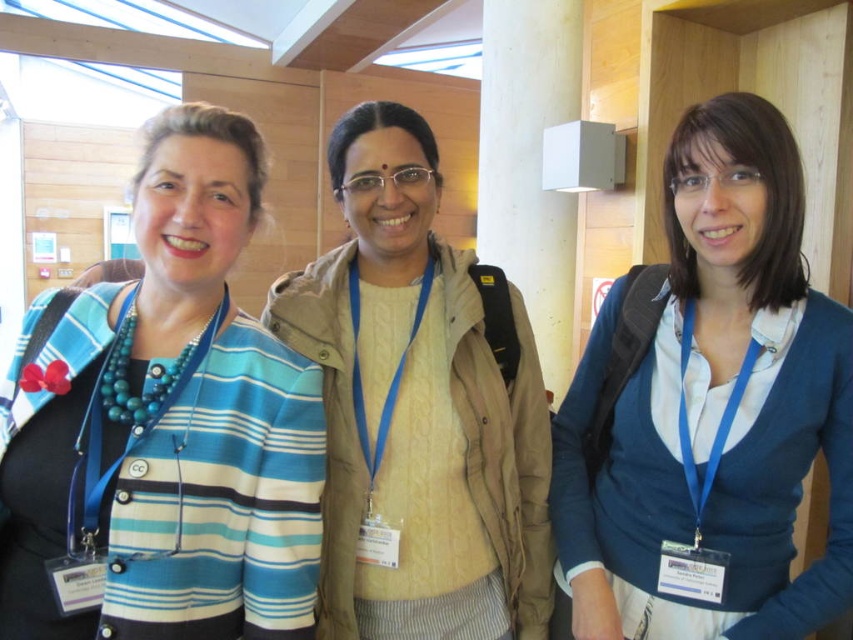
You are standing in the conference room and want to take a photo of the blue striped cardigan at left. Where should you position yourself to capture it in the frame?

To capture the blue striped cardigan at left in the frame, position yourself facing the cardigan and ensure your camera is aimed at the coordinates approximately at point 0.669 on the horizontal axis and 0.193 on the vertical axis, as specified by the object description.

You are a photographer trying to capture a clear shot of both the blue matte sweater at center and the beige woolen sweater at center. Which sweater should you focus on first to ensure both are in focus?

You should focus on the blue matte sweater at center first since it is closer to the viewer, and then adjust the focus to include the beige woolen sweater at center, ensuring both are in focus.